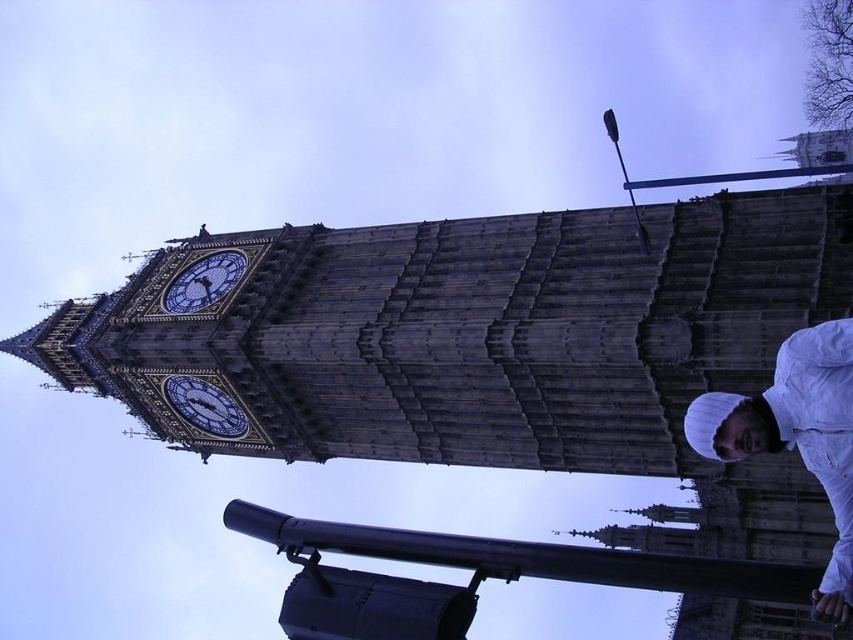
You are standing in front of the Elizabeth Tower and want to take a photo that includes both the black metal pole at lower center and the clock faces of the tower. Based on their positions, where should you position yourself to ensure both elements are in the frame?

To include both the black metal pole at lower center and the clock faces of the Elizabeth Tower in your photo, position yourself so that the black metal pole at lower center is near the lower part of your frame, while the clock faces are centered or higher up. This arrangement uses their differing vertical positions to ensure both are captured in the shot.